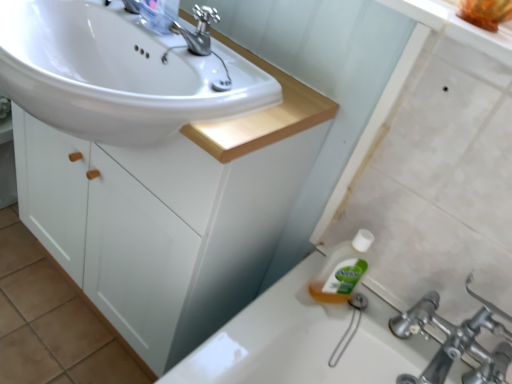
Question: Is white matte cabinet at center bigger or smaller than clear plastic bottle at upper center?

Choices:
 (A) small
 (B) big

Answer: (B)

Question: From a real-world perspective, is white matte cabinet at center physically located above or below clear plastic bottle at upper center?

Choices:
 (A) above
 (B) below

Answer: (B)

Question: Considering the real-world distances, which object is farthest from the white matte cabinet at center?

Choices:
 (A) white glossy sink at upper left
 (B) clear plastic bottle at upper center
 (C) polished metallic faucet at upper center

Answer: (B)

Question: Estimate the real-world distances between objects in this image. Which object is farther from the white glossy sink at upper left?

Choices:
 (A) polished metallic faucet at upper center
 (B) clear plastic bottle at upper center
 (C) white matte cabinet at center

Answer: (C)